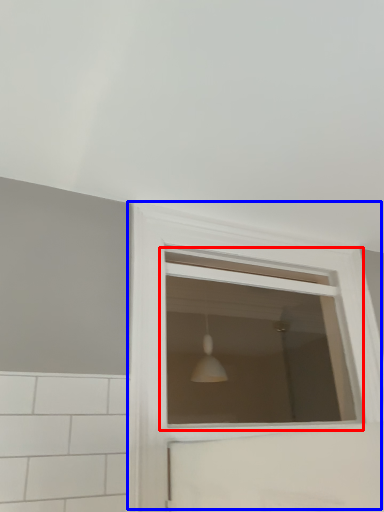
Question: Which of the following is the closest to the observer, window (highlighted by a red box) or window (highlighted by a blue box)?

Choices:
 (A) window
 (B) window

Answer: (B)